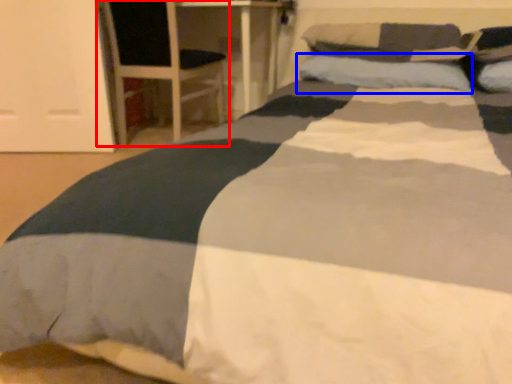
Question: Which point is further to the camera, armchair (highlighted by a red box) or pillow (highlighted by a blue box)?

Choices:
 (A) armchair
 (B) pillow

Answer: (A)